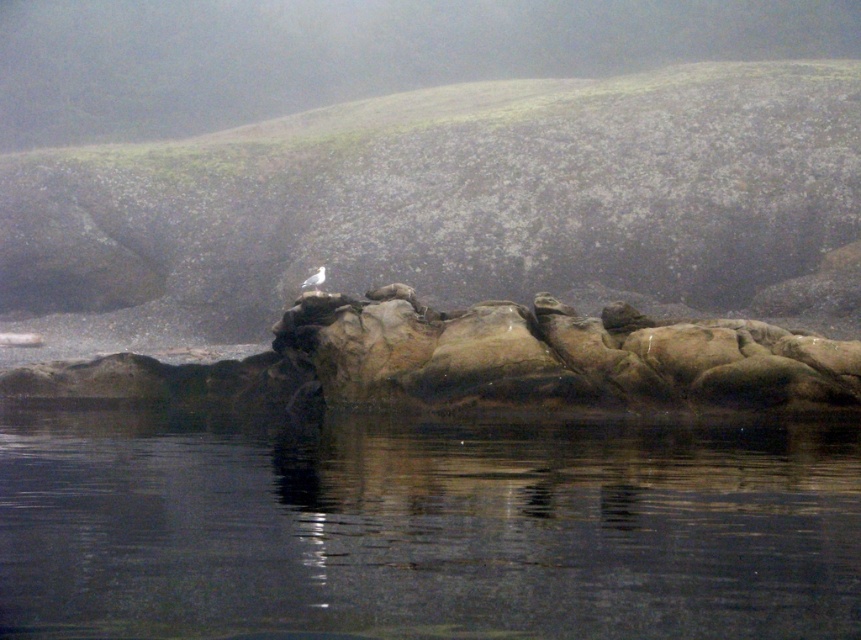
You are a photographer trying to capture the white matte bird at center in your shot. The transparent water at center is reflecting the bird. How does the size of the reflection compare to the actual bird?

The transparent water at center has a larger size compared to white matte bird at center, so the reflection of the white matte bird at center on the transparent water at center will appear larger than the actual bird.